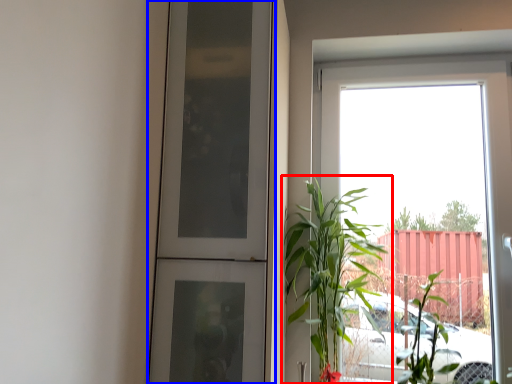
Question: Which point is closer to the camera, houseplant (highlighted by a red box) or door (highlighted by a blue box)?

Choices:
 (A) houseplant
 (B) door

Answer: (B)